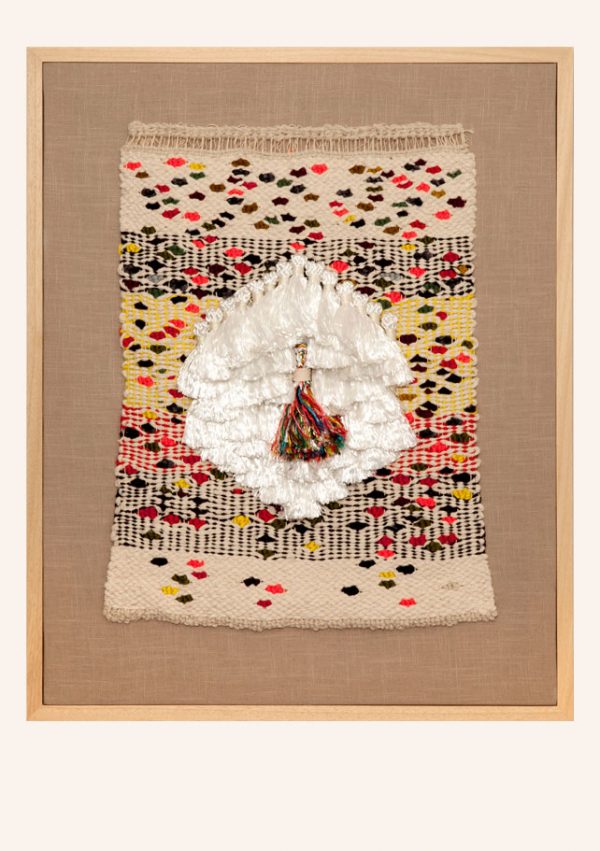
Locate an element on the screen. This screenshot has height=851, width=600. tassle is located at coordinates (314, 426).